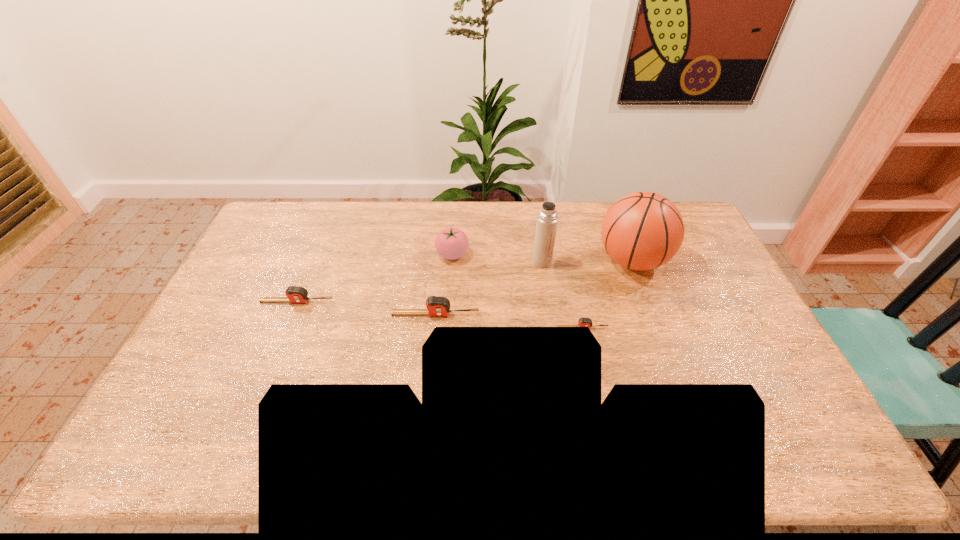
This screenshot has width=960, height=540. What are the coordinates of `the second tallest tape measure` in the screenshot? It's located at (295, 294).

What are the coordinates of `the leftmost tape measure` in the screenshot? It's located at (295, 294).

Identify the location of the second nearest object. Image resolution: width=960 pixels, height=540 pixels. (436, 306).

Locate an element on the screen. This screenshot has height=540, width=960. the second nearest tape measure is located at coordinates pos(436,306).

You are a GUI agent. You are given a task and a screenshot of the screen. Output one action in this format:
    pyautogui.click(x=<x>, y=<y>)
    Task: Click on the shortest object
    The width and height of the screenshot is (960, 540).
    Given the screenshot: What is the action you would take?
    pyautogui.click(x=583, y=322)

Where is `the nearest object`? the nearest object is located at coordinates (583, 322).

What are the coordinates of `the third tallest object` in the screenshot? It's located at (451, 243).

Identify the location of basketball. (642, 231).

Image resolution: width=960 pixels, height=540 pixels. I want to click on thermos bottle, so click(x=546, y=226).

This screenshot has width=960, height=540. Find the location of `vacant space located on the left of the third nearest object`. vacant space located on the left of the third nearest object is located at coordinates (222, 301).